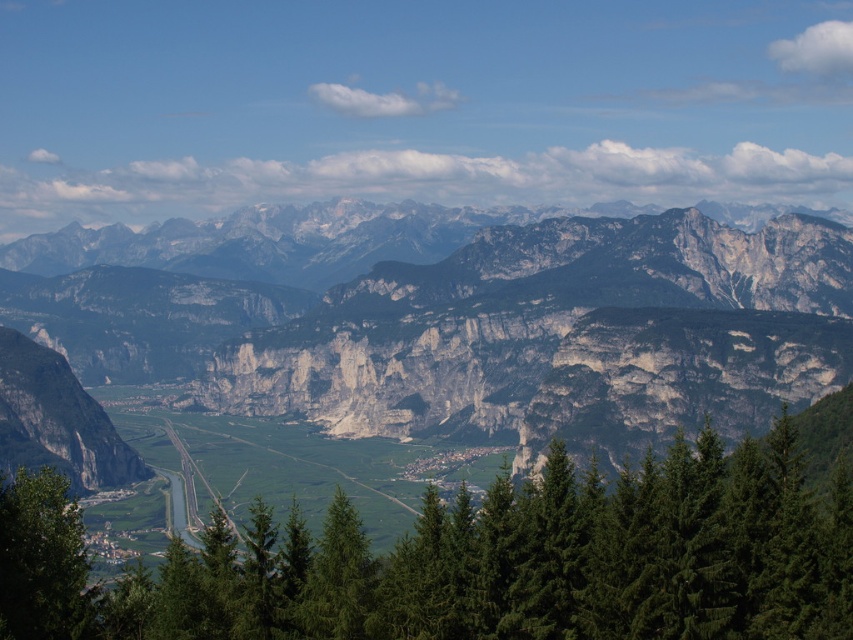
Question: Which object is positioned farthest from the rocky gray mountain range at center?

Choices:
 (A) green leafy tree at lower left
 (B) green textured tree at center

Answer: (A)

Question: Estimate the real-world distances between objects in this image. Which object is farther from the rocky gray mountain range at center?

Choices:
 (A) green textured tree at center
 (B) green leafy tree at lower left

Answer: (B)

Question: Can you confirm if rocky gray mountain range at center is positioned to the right of green leafy tree at lower left?

Choices:
 (A) no
 (B) yes

Answer: (B)

Question: Can you confirm if rocky gray mountain range at center is bigger than green leafy tree at lower left?

Choices:
 (A) no
 (B) yes

Answer: (B)

Question: Does rocky gray mountain range at center appear on the right side of green leafy tree at lower left?

Choices:
 (A) yes
 (B) no

Answer: (A)

Question: Which point is closer to the camera?

Choices:
 (A) (x=53, y=634)
 (B) (x=314, y=392)

Answer: (A)